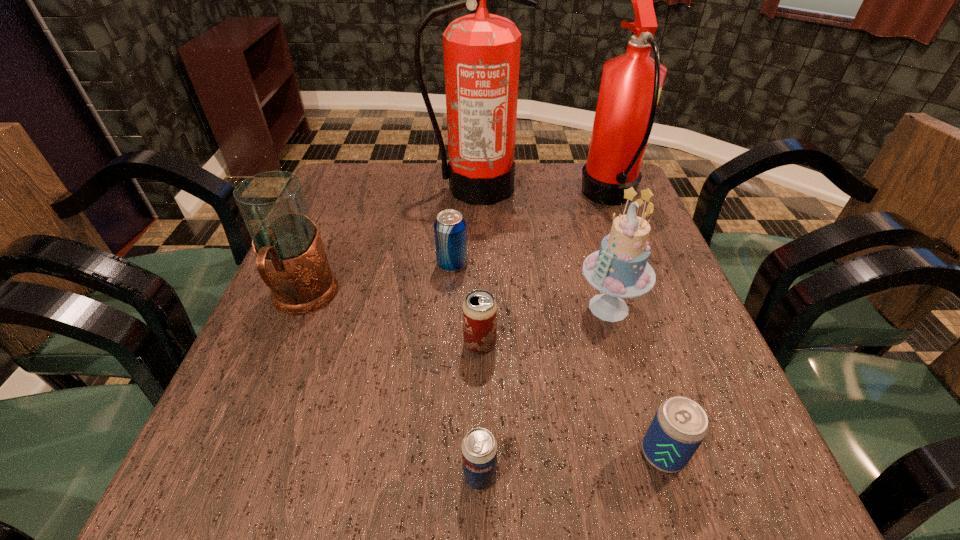
In order to click on cake present at the right edge in this screenshot , I will do coord(619,269).

Find the location of `beer can that is at the right edge`. beer can that is at the right edge is located at coordinates (679, 426).

Find the location of a particular element. The width and height of the screenshot is (960, 540). object positioned at the far right corner is located at coordinates (631, 84).

This screenshot has height=540, width=960. In order to click on object located at the near right corner in this screenshot , I will do `click(679, 426)`.

I want to click on free spot at the far edge of the desktop, so coord(518,180).

In the image, there is a desktop. At what (x,y) coordinates should I click in order to perform the action: click on free region at the near edge. Please return your answer as a coordinate pair (x, y). Looking at the image, I should click on (417, 514).

Identify the location of blank area at the left edge. This screenshot has height=540, width=960. (334, 273).

In the image, there is a desktop. At what (x,y) coordinates should I click in order to perform the action: click on vacant space at the right edge. Please return your answer as a coordinate pair (x, y). Looking at the image, I should click on (686, 372).

Where is `vacant space at the far left corner of the desktop`? Image resolution: width=960 pixels, height=540 pixels. vacant space at the far left corner of the desktop is located at coordinates (358, 165).

In the image, there is a desktop. Identify the location of vacant space at the near left corner. Image resolution: width=960 pixels, height=540 pixels. (289, 470).